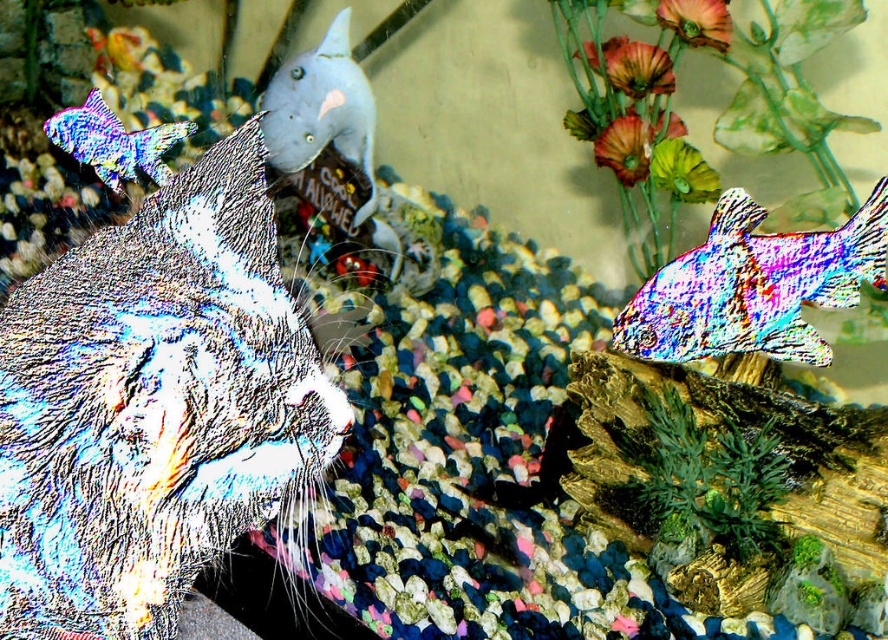
Question: Does shiny metallic fish at upper left have a lesser width compared to matte orange flower at upper right?

Choices:
 (A) no
 (B) yes

Answer: (A)

Question: Which object is farther from the camera taking this photo?

Choices:
 (A) shiny iridescent fish at right
 (B) matte pink flower at upper center
 (C) shiny metallic fish at upper left

Answer: (B)

Question: Where is fluffy gray cat at upper left located in relation to green matte flower at upper right in the image?

Choices:
 (A) left
 (B) right

Answer: (A)

Question: Among these points, which one is nearest to the camera?

Choices:
 (A) (619, 72)
 (B) (679, 189)

Answer: (A)

Question: Which is nearer to the green matte flower at upper right?

Choices:
 (A) shiny metallic fish at upper left
 (B) matte orange flower at upper right
 (C) matte gray fish at upper center
 (D) matte pink flower at upper center

Answer: (D)

Question: Can you confirm if shiny iridescent fish at right is positioned to the left of matte gray fish at upper center?

Choices:
 (A) no
 (B) yes

Answer: (A)